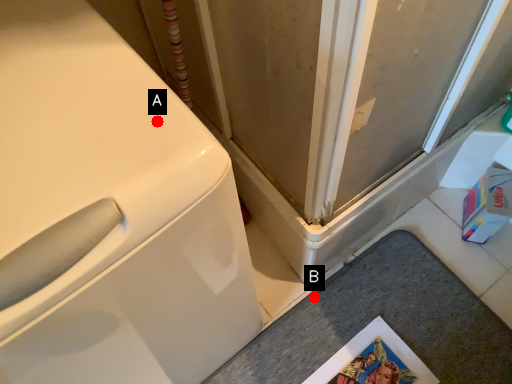
Question: Two points are circled on the image, labeled by A and B beside each circle. Among these points, which one is nearest to the camera?

Choices:
 (A) A is closer
 (B) B is closer

Answer: (A)